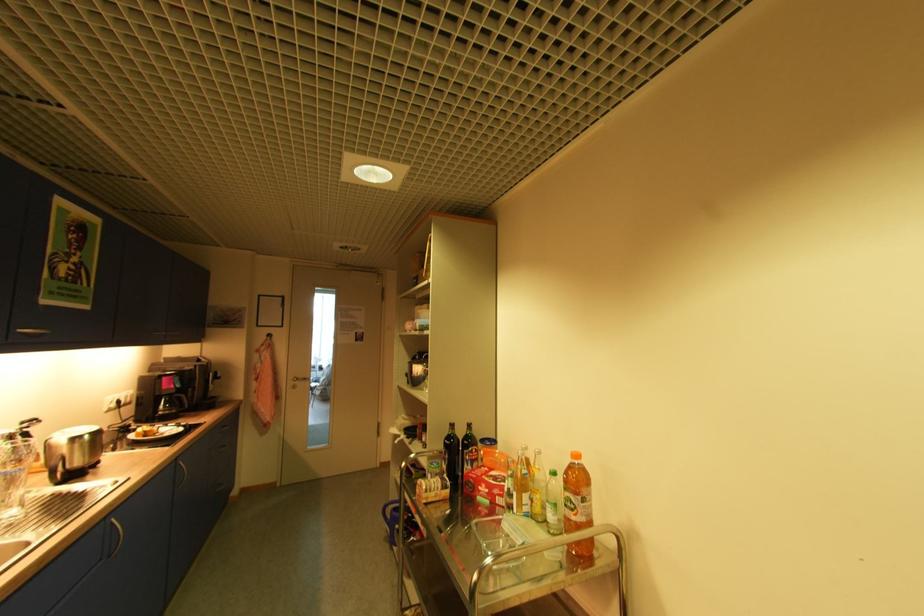
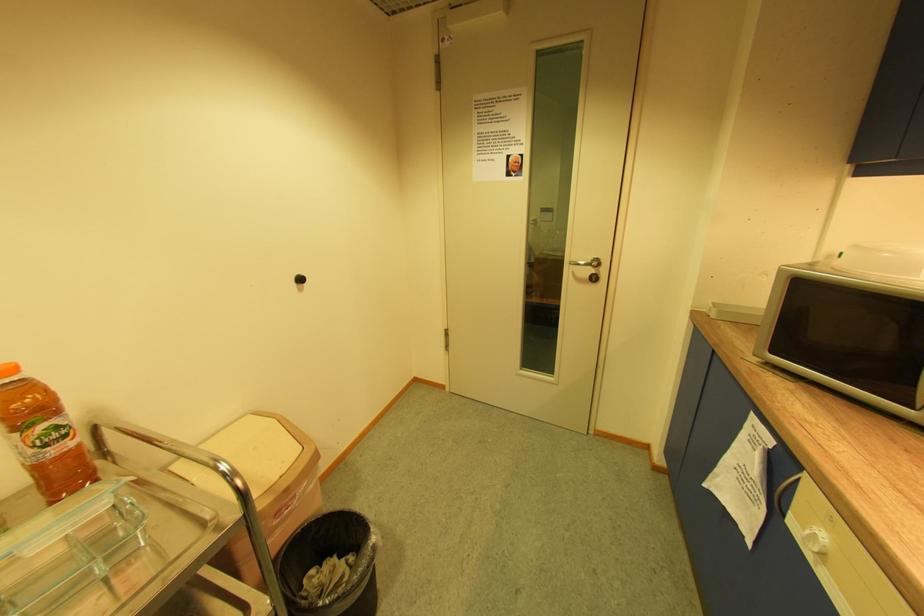
The point at (575, 506) is marked in the first image. Where is the corresponding point in the second image?

(61, 437)